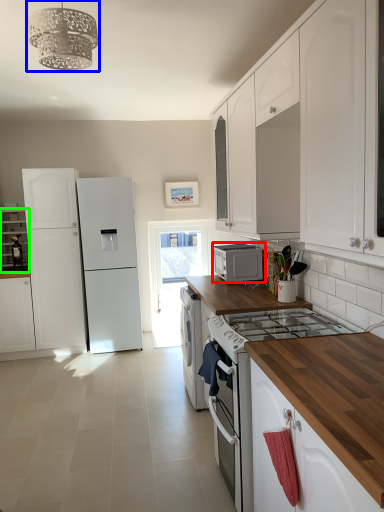
Question: Considering the real-world distances, which object is closest to microwave oven (highlighted by a red box)? light fixture (highlighted by a blue box) or cabinetry (highlighted by a green box).

Choices:
 (A) light fixture
 (B) cabinetry

Answer: (A)